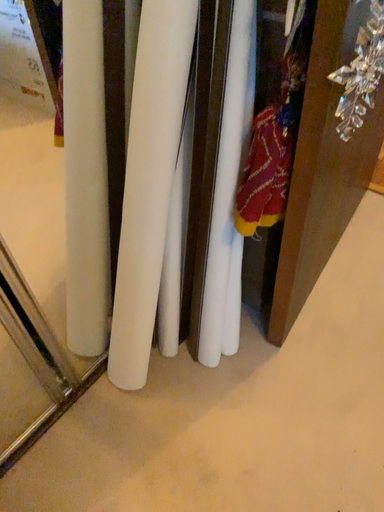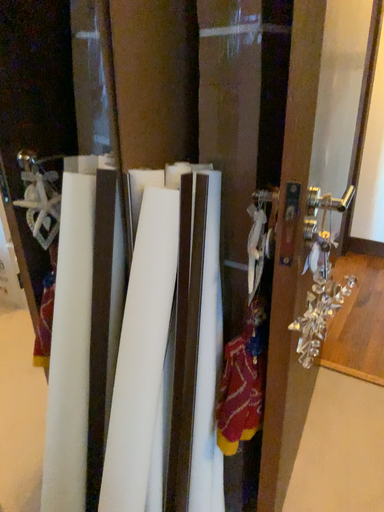
Question: How did the camera likely rotate when shooting the video?

Choices:
 (A) rotated downward
 (B) rotated upward

Answer: (B)